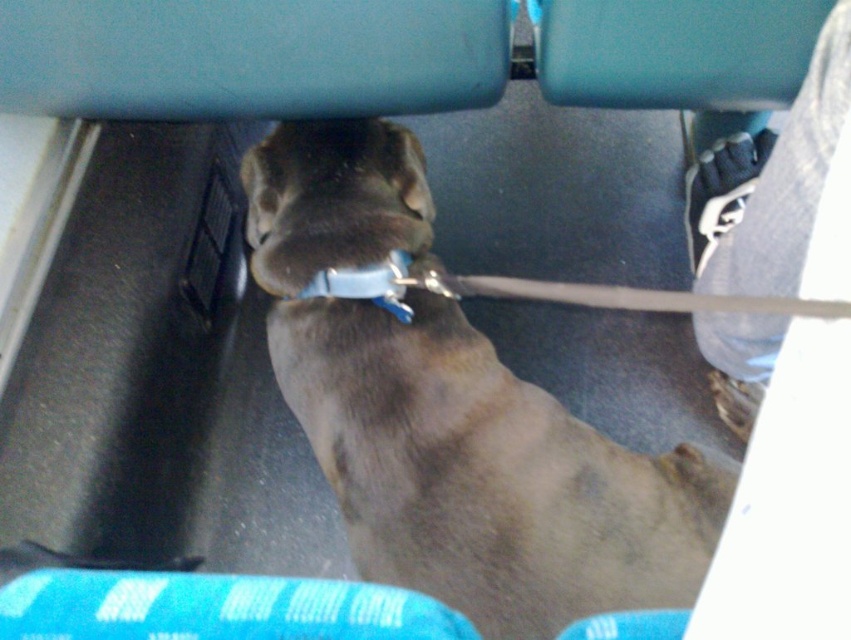
Question: Does brown fur dog at center appear over brown fur nose at center?

Choices:
 (A) no
 (B) yes

Answer: (A)

Question: Is brown fur dog at center below brown fur nose at center?

Choices:
 (A) no
 (B) yes

Answer: (B)

Question: Among these points, which one is farthest from the camera?

Choices:
 (A) (290, 381)
 (B) (401, 276)

Answer: (A)

Question: Which point is closer to the camera?

Choices:
 (A) brown fur dog at center
 (B) blue fabric neckband at center

Answer: (A)

Question: Is brown fur dog at center in front of brown fur nose at center?

Choices:
 (A) no
 (B) yes

Answer: (B)

Question: Which point is closer to the camera?

Choices:
 (A) (386, 268)
 (B) (261, 273)

Answer: (A)